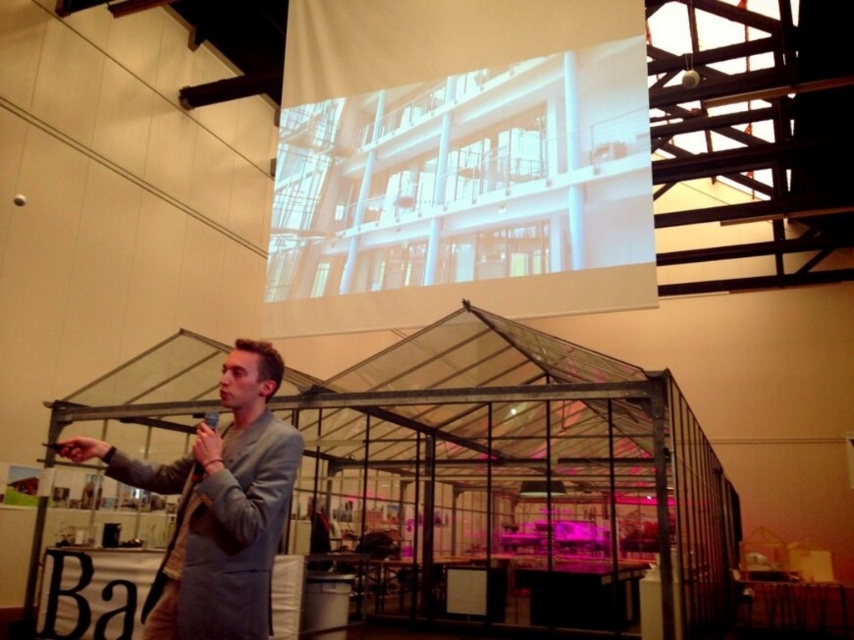
Question: In this image, where is white matte projection screen at upper center located relative to light gray suit at center?

Choices:
 (A) left
 (B) right

Answer: (B)

Question: Does white matte projection screen at upper center have a lesser width compared to light gray suit at center?

Choices:
 (A) no
 (B) yes

Answer: (A)

Question: Which point is closer to the camera taking this photo?

Choices:
 (A) (293, 280)
 (B) (165, 612)

Answer: (B)

Question: Is white matte projection screen at upper center smaller than light gray suit at center?

Choices:
 (A) yes
 (B) no

Answer: (B)